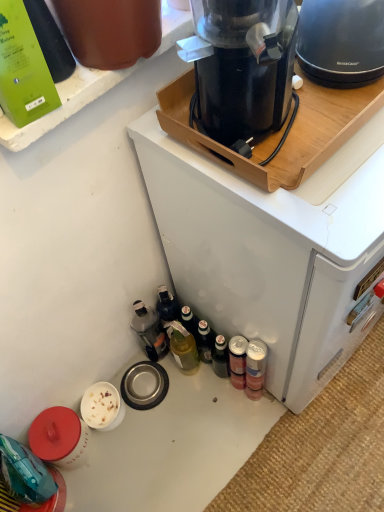
At what (x,y) coordinates should I click in order to perform the action: click on free location in front of translucent plastic bottle at lower left, arranged as the second bottle when ordered from the bottom. Please return your answer as a coordinate pair (x, y). The image size is (384, 512). Looking at the image, I should click on (176, 408).